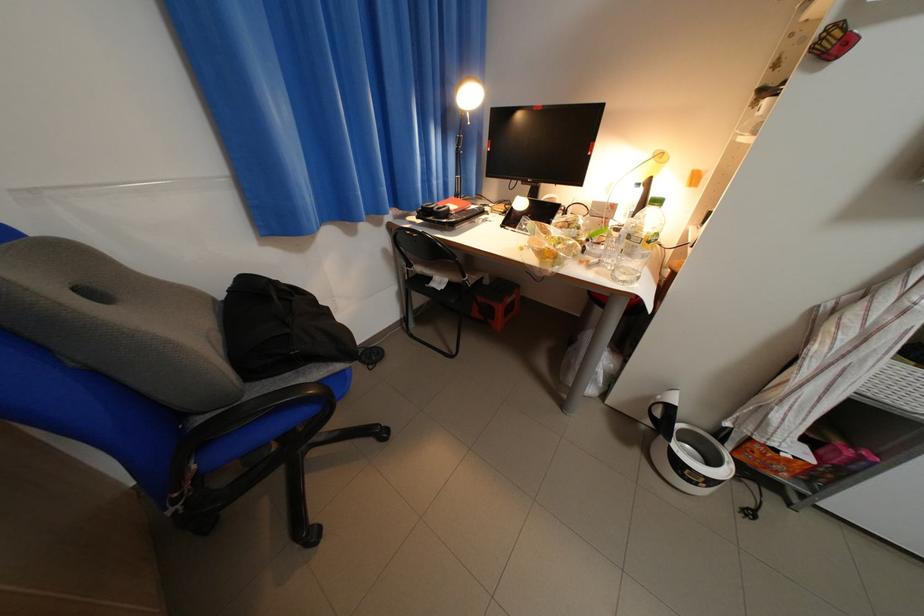
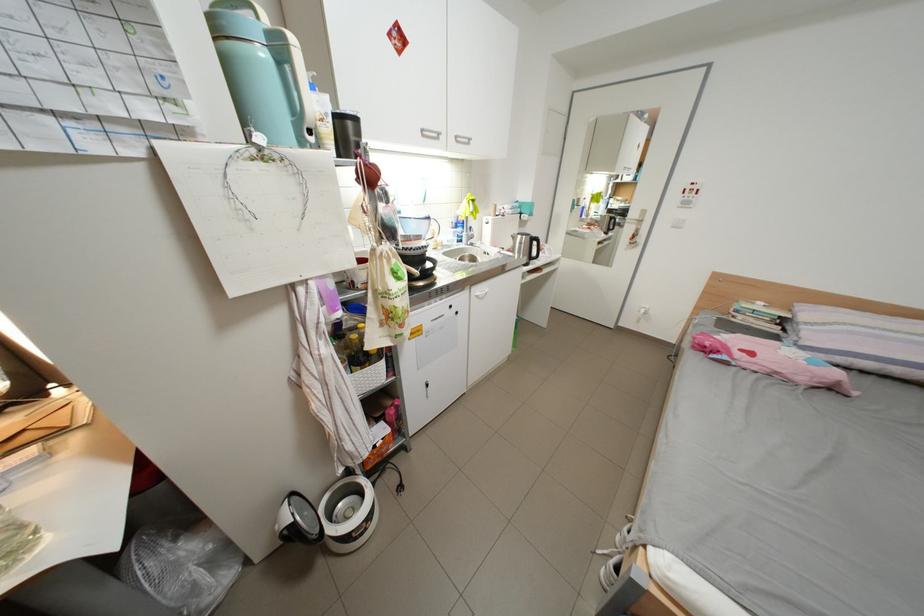
The first image is from the beginning of the video and the second image is from the end. How did the camera likely rotate when shooting the video?

The camera rotated toward right-down.